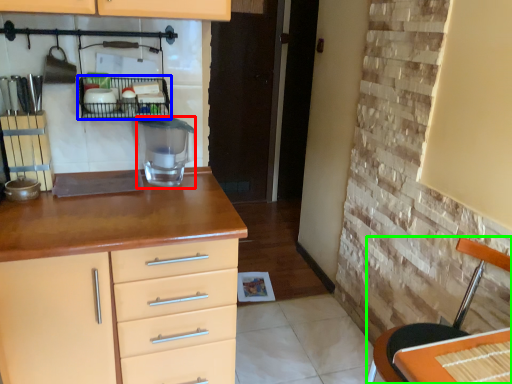
Question: Which is farther away from appliance (highlighted by a red box)? shelf (highlighted by a blue box) or chair (highlighted by a green box)?

Choices:
 (A) shelf
 (B) chair

Answer: (B)